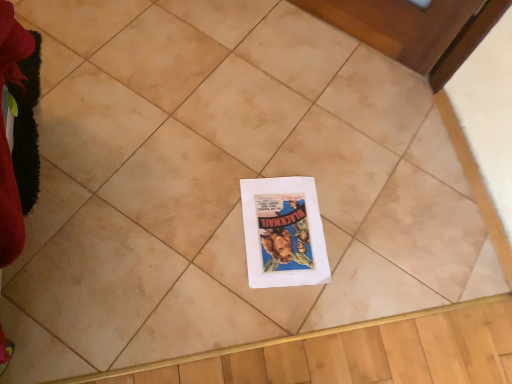
Where is `vacant space in front of white paper flyer at center`? vacant space in front of white paper flyer at center is located at coordinates (246, 306).